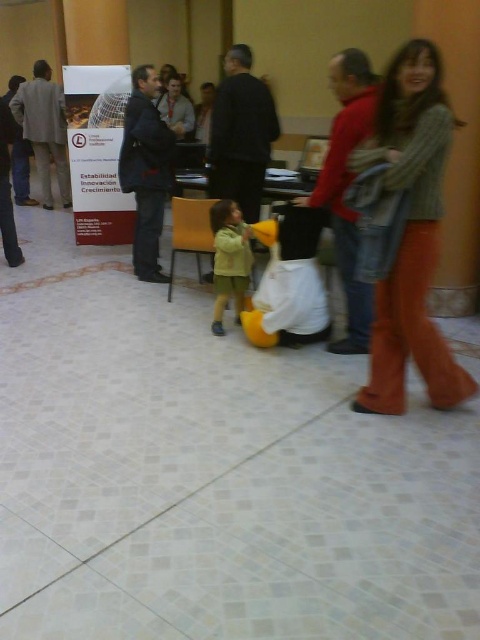
You are an interior designer assessing the placement of clothing items in the image. The orange cotton pants at right and the matte gray suit at left are both hanging on a rack. Which clothing item is placed lower on the rack?

Answer: The orange cotton pants at right is positioned under the matte gray suit at left, so it is placed lower on the rack.

You are standing in the conference room and see two points marked in the scene. Which point is closer to you, point (34,134) or point (230,221)?

Point (34,134) is closer to you because it is further to the viewer than point (230,221).

You are standing in the room and see the point at coordinates [45,129]. What object is located at that point?

The point at coordinates [45,129] indicates the matte gray suit at left.